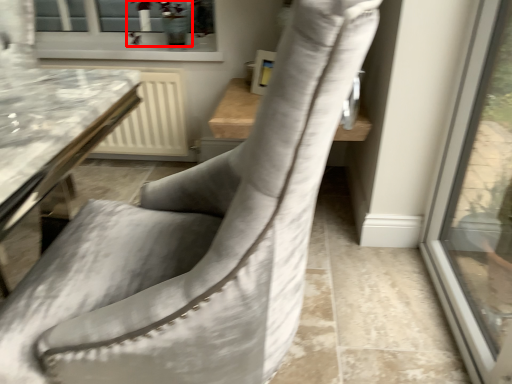
Question: From the image's perspective, what is the correct spatial positioning of plant (annotated by the red box) in reference to chair?

Choices:
 (A) above
 (B) below

Answer: (A)